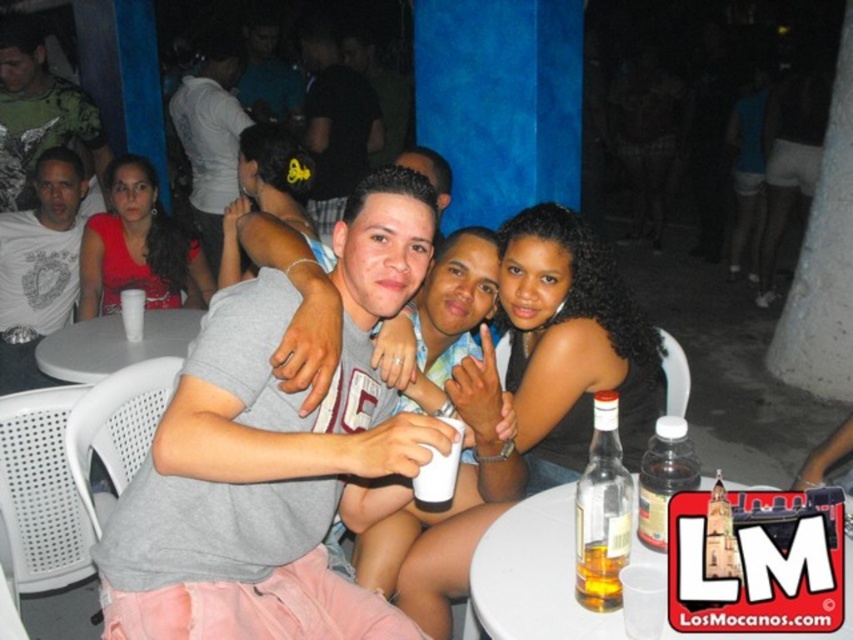
Question: Which point is farther from the camera taking this photo?

Choices:
 (A) coord(531,554)
 (B) coord(448,497)

Answer: (B)

Question: Is light gray fabric hairband at upper center above white plastic cup at center?

Choices:
 (A) no
 (B) yes

Answer: (B)

Question: Does black matte hair at center have a lesser width compared to white plastic table at lower center?

Choices:
 (A) yes
 (B) no

Answer: (A)

Question: Which of the following is the closest to the observer?

Choices:
 (A) white plastic table at lower center
 (B) matte black shirt at center

Answer: (A)

Question: Can you confirm if matte gray shirt at center is positioned to the right of golden glass bottle at table center?

Choices:
 (A) yes
 (B) no

Answer: (B)

Question: Which point is closer to the camera?

Choices:
 (A) (440, 492)
 (B) (552, 204)

Answer: (A)